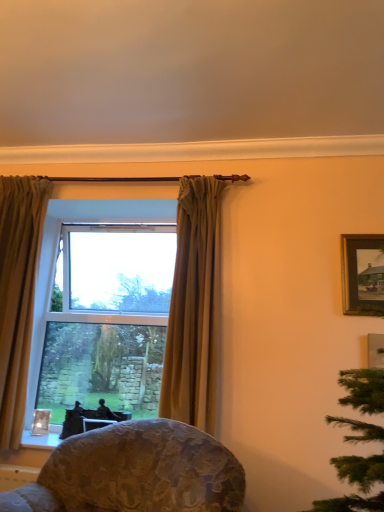
Question: Is floral fabric chair at lower center beside clear glass window at center?

Choices:
 (A) no
 (B) yes

Answer: (A)

Question: Is floral fabric chair at lower center at the left side of clear glass window at center?

Choices:
 (A) no
 (B) yes

Answer: (A)

Question: From a real-world perspective, is floral fabric chair at lower center located higher than clear glass window at center?

Choices:
 (A) yes
 (B) no

Answer: (B)

Question: Does floral fabric chair at lower center contain clear glass window at center?

Choices:
 (A) yes
 (B) no

Answer: (B)

Question: Is floral fabric chair at lower center not inside clear glass window at center?

Choices:
 (A) yes
 (B) no

Answer: (A)

Question: In terms of height, does matte gold curtain at center, the 2th curtain positioned from the left, look taller or shorter compared to gold textured curtain at left, the first curtain positioned from the left?

Choices:
 (A) short
 (B) tall

Answer: (A)

Question: Considering the positions of matte gold curtain at center, the 2th curtain positioned from the left, and gold textured curtain at left, the first curtain positioned from the left, in the image, is matte gold curtain at center, the 2th curtain positioned from the left, wider or thinner than gold textured curtain at left, the first curtain positioned from the left,?

Choices:
 (A) thin
 (B) wide

Answer: (B)

Question: Is point (215, 275) positioned closer to the camera than point (31, 292)?

Choices:
 (A) closer
 (B) farther

Answer: (A)

Question: Is matte gold curtain at center, marked as the 1th curtain in a right-to-left arrangement, to the left or to the right of gold textured curtain at left, arranged as the 2th curtain when viewed from the right, in the image?

Choices:
 (A) left
 (B) right

Answer: (B)

Question: From the image's perspective, is clear glass window at center positioned above or below wooden framed painting at upper right?

Choices:
 (A) below
 (B) above

Answer: (A)

Question: In terms of width, does clear glass window at center look wider or thinner when compared to wooden framed painting at upper right?

Choices:
 (A) wide
 (B) thin

Answer: (A)

Question: Considering the positions of clear glass window at center and wooden framed painting at upper right in the image, is clear glass window at center taller or shorter than wooden framed painting at upper right?

Choices:
 (A) tall
 (B) short

Answer: (A)

Question: From a real-world perspective, is clear glass window at center positioned above or below wooden framed painting at upper right?

Choices:
 (A) below
 (B) above

Answer: (A)

Question: Looking at the image, does gold textured curtain at left, arranged as the 2th curtain when viewed from the right, seem bigger or smaller compared to wooden framed painting at upper right?

Choices:
 (A) small
 (B) big

Answer: (B)

Question: Is gold textured curtain at left, the first curtain positioned from the left, in front of or behind wooden framed painting at upper right in the image?

Choices:
 (A) behind
 (B) front

Answer: (A)